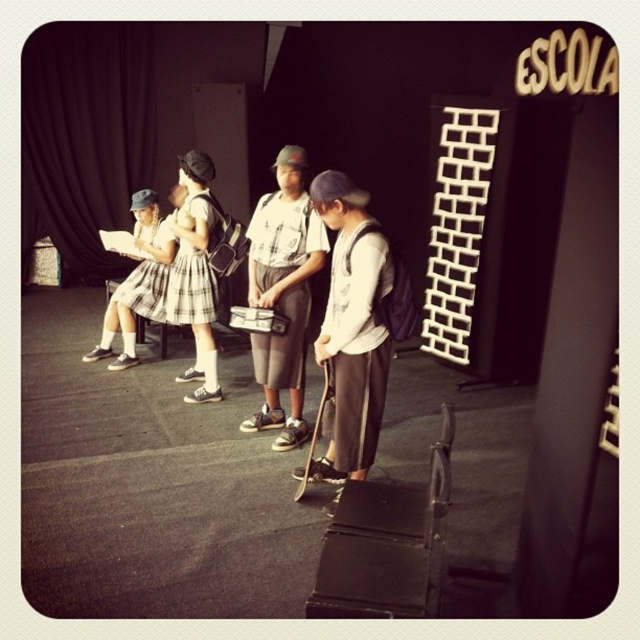
Question: Which point is farther from the camera taking this photo?

Choices:
 (A) (132, 339)
 (B) (365, 452)

Answer: (A)

Question: Which is nearer to the plaid skirt at left?

Choices:
 (A) white matte shirt at center
 (B) matte white shirt at center

Answer: (B)

Question: Considering the relative positions of white matte shirt at center and matte white shirt at center in the image provided, where is white matte shirt at center located with respect to matte white shirt at center?

Choices:
 (A) left
 (B) right

Answer: (B)

Question: Is matte white shirt at center thinner than plaid skirt at left?

Choices:
 (A) yes
 (B) no

Answer: (A)

Question: Observing the image, what is the correct spatial positioning of white matte shirt at center in reference to matte white shirt at center?

Choices:
 (A) below
 (B) above

Answer: (A)

Question: Which of the following is the farthest from the observer?

Choices:
 (A) white matte shirt at center
 (B) plaid skirt at left

Answer: (B)